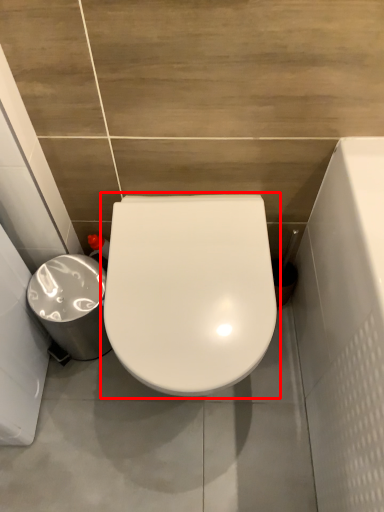
Question: From the image, what is the correct spatial relationship of toilet (annotated by the red box) in relation to porcelain?

Choices:
 (A) left
 (B) right

Answer: (B)